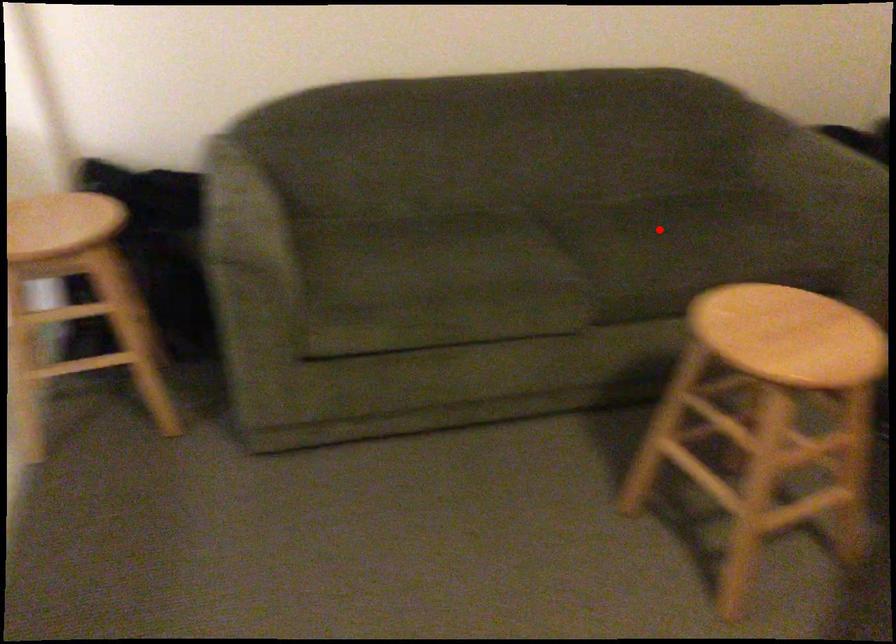
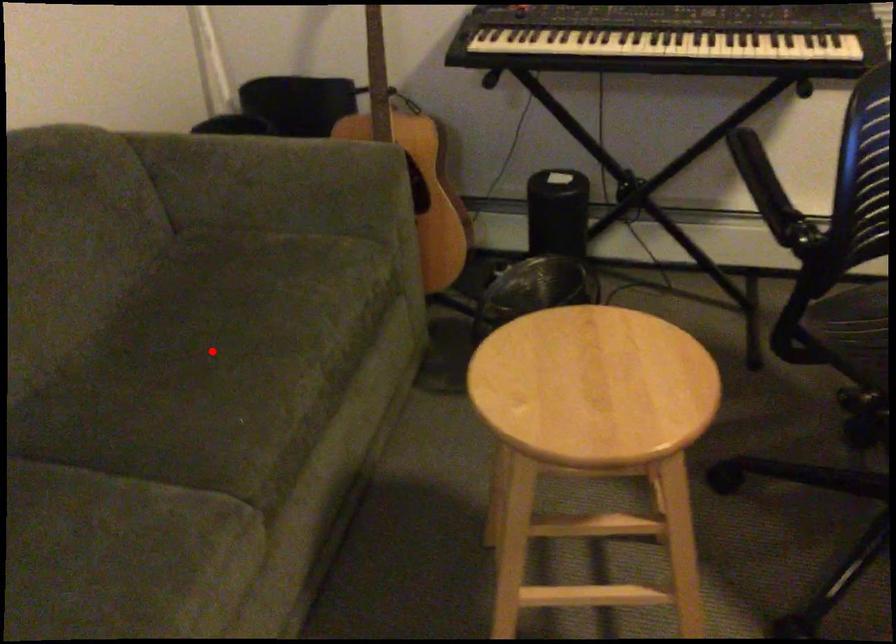
I am providing you with two images of the same scene from different viewpoints. A red point is marked on the first image and another point is marked on the second image. Is the marked point in image1 the same physical position as the marked point in image2?

Yes